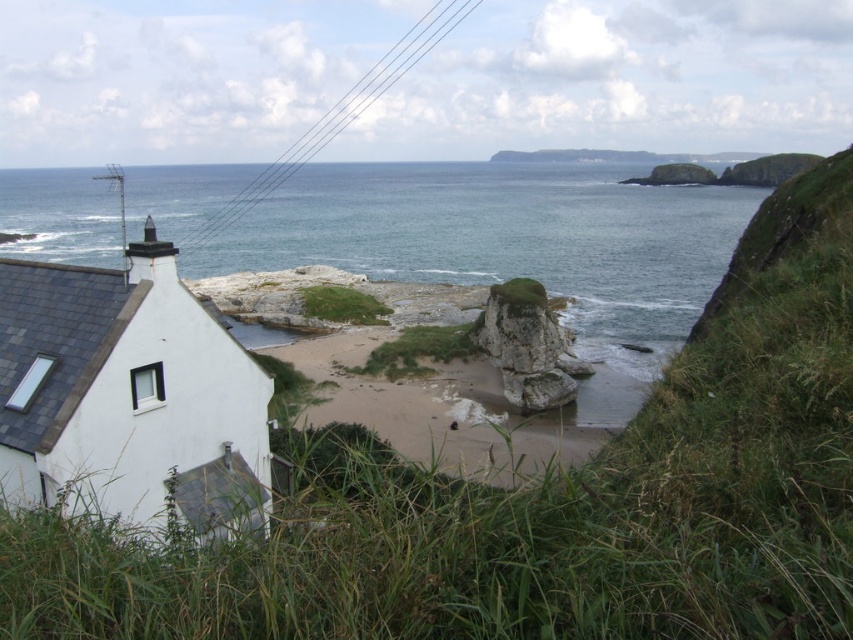
You are a photographer planning to capture the coastal scene. You want to ensure that the blue water at center and the rough stone rock at center are both visible in your shot. Which object should you frame to take up more space in the photo?

The blue water at center should be framed to take up more space in the photo since it is bigger than the rough stone rock at center according to the description.

You are standing on the grassy area near the white building with a dark gray slate roof. You want to walk to the blue water at center. Is the rough stone rock at center blocking your path?

The blue water at center is in front of the rough stone rock at center, meaning the rock is behind the water. Therefore, the rough stone rock at center is not blocking your path to the blue water at center.

You are standing on the beach and want to take a photo of both the white matte house at lower left and the rough stone rock at center. Which object should you frame first in your camera to ensure both are in the shot?

You should frame the white matte house at lower left first because it is positioned on the left side of the rough stone rock at center, so by starting with the house on the left, you can include both objects in the frame.